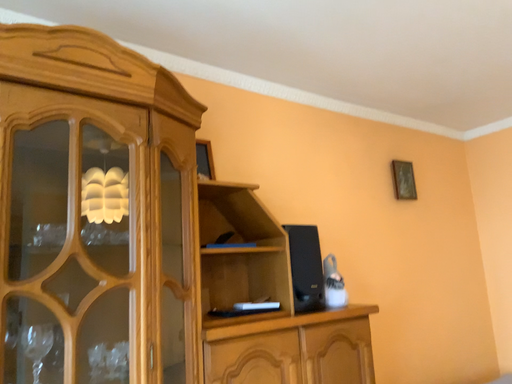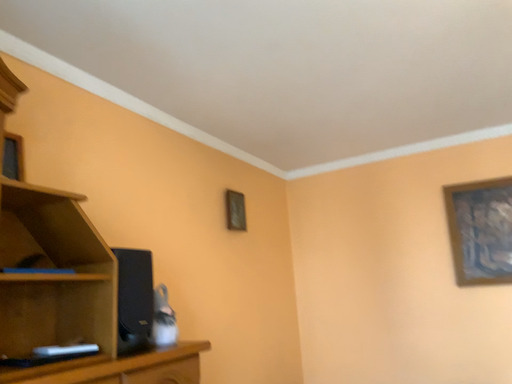
Question: Which way did the camera rotate in the video?

Choices:
 (A) rotated right
 (B) rotated left

Answer: (A)